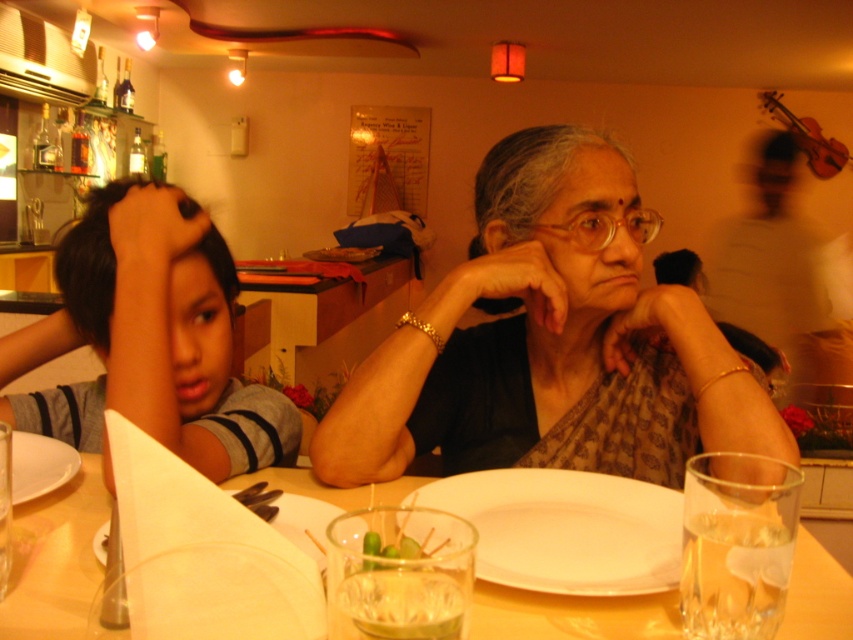
Question: Which point appears closest to the camera in this image?

Choices:
 (A) (682, 520)
 (B) (318, 540)

Answer: (A)

Question: Does white matte plate at lower left have a greater width compared to green leafy vegetable at center?

Choices:
 (A) no
 (B) yes

Answer: (B)

Question: Estimate the real-world distances between objects in this image. Which object is closer to the brown silk saree at center?

Choices:
 (A) dark skin hand at left
 (B) green leafy vegetable at center

Answer: (A)

Question: Does smooth white shirt at upper right appear over white matte plate at lower left?

Choices:
 (A) yes
 (B) no

Answer: (A)

Question: Does clear glass at lower right appear under clear glass at lower center?

Choices:
 (A) no
 (B) yes

Answer: (B)

Question: Among these objects, which one is farthest from the camera?

Choices:
 (A) smooth white shirt at upper right
 (B) white matte plate at lower center
 (C) dark skin hand at left

Answer: (A)